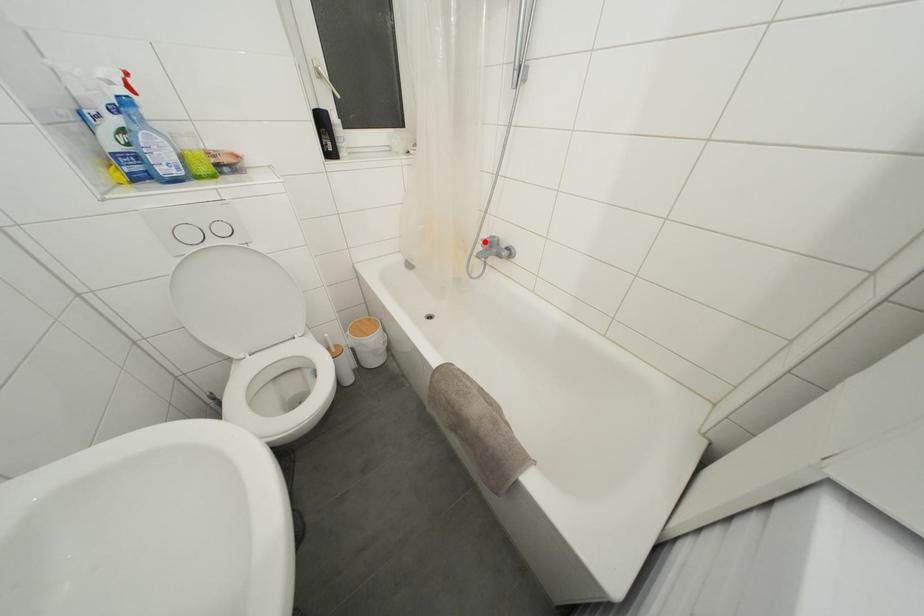
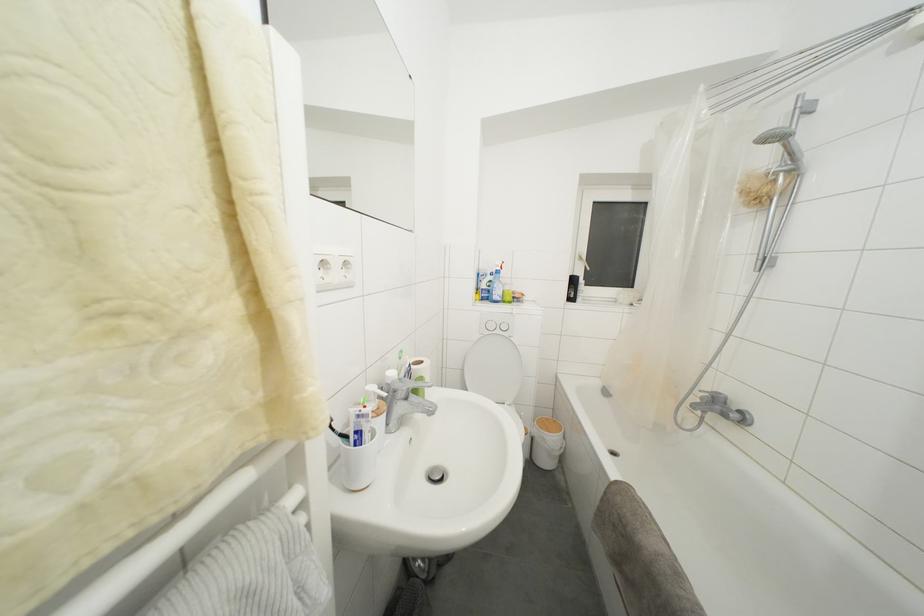
Question: I am providing you with two images of the same scene from different viewpoints. Image1 has a red point marked. In image2, the corresponding 3D location appears at what relative position? Reply with the corresponding letter.

Choices:
 (A) Closer
 (B) Farther

Answer: (B)